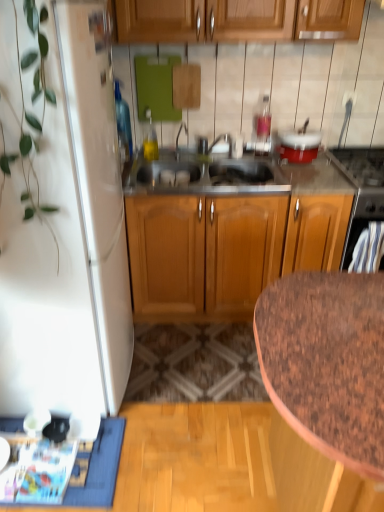
Locate an element on the screen. vacant area on top of blue fabric doormat at lower left (from a real-world perspective) is located at coordinates (55, 458).